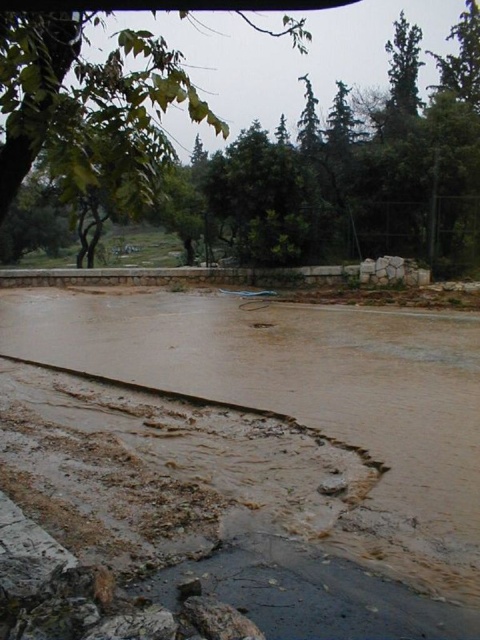
Question: Can you confirm if brown muddy water at lower left is bigger than green leafy tree at upper left?

Choices:
 (A) yes
 (B) no

Answer: (B)

Question: Which object is farther from the camera taking this photo?

Choices:
 (A) green leafy tree at upper left
 (B) brown muddy water at lower left

Answer: (B)

Question: Among these objects, which one is nearest to the camera?

Choices:
 (A) brown muddy water at lower left
 (B) green leafy tree at upper left

Answer: (B)

Question: Is brown muddy water at lower left positioned in front of green leafy tree at upper left?

Choices:
 (A) no
 (B) yes

Answer: (A)

Question: Is brown muddy water at lower left to the right of green leafy tree at upper left from the viewer's perspective?

Choices:
 (A) no
 (B) yes

Answer: (B)